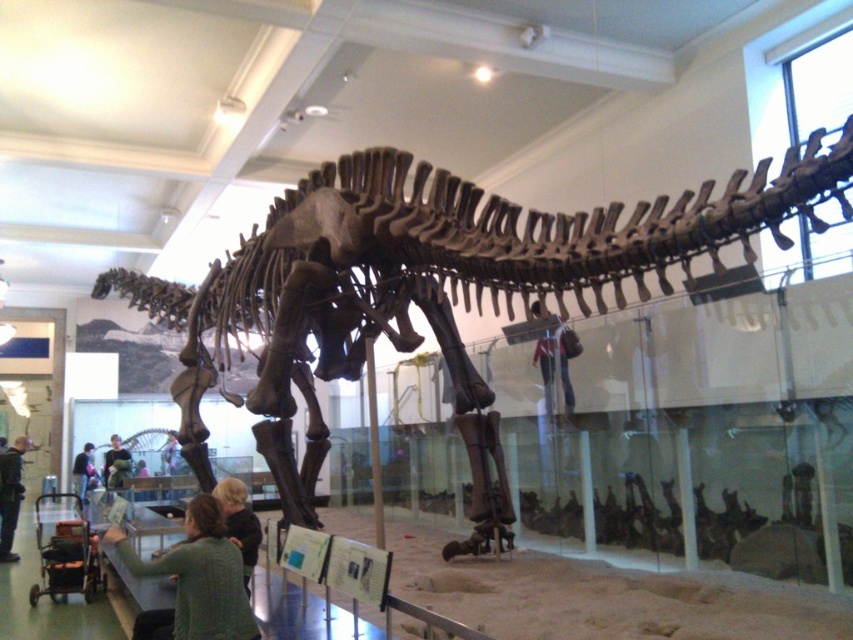
Question: In this image, where is green sweater at lower left located relative to dark brown leather jacket at lower left?

Choices:
 (A) above
 (B) below

Answer: (A)

Question: Where is denim jacket at center located in relation to green fabric shirt at lower left in the image?

Choices:
 (A) below
 (B) above

Answer: (B)

Question: Estimate the real-world distances between objects in this image. Which object is closer to the green sweater at lower left?

Choices:
 (A) dark brown leather jacket at lower left
 (B) green fabric shirt at lower center
 (C) denim jacket at center

Answer: (B)

Question: Which point appears closest to the camera in this image?

Choices:
 (A) (252, 561)
 (B) (4, 525)
 (C) (573, 348)
 (D) (83, 456)

Answer: (A)

Question: Is dark green sweater at lower left smaller than green fabric shirt at lower left?

Choices:
 (A) yes
 (B) no

Answer: (B)

Question: Estimate the real-world distances between objects in this image. Which object is closer to the green sweater at lower left?

Choices:
 (A) denim jacket at center
 (B) dark brown leather jacket at lower left
 (C) dark green sweater at lower left
 (D) green fabric shirt at lower left

Answer: (A)